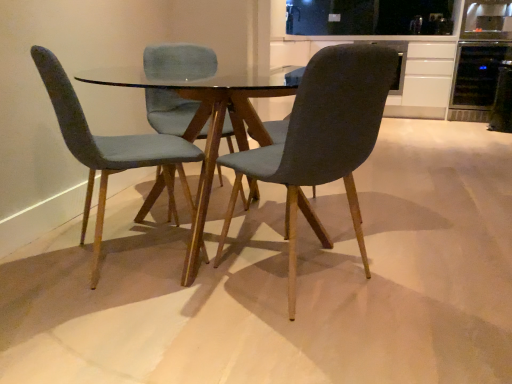
Question: Considering the positions of dark gray fabric chair at center, acting as the 1th chair starting from the right, and black glass wine cooler at upper right, the 1th appliance from the back, in the image, is dark gray fabric chair at center, acting as the 1th chair starting from the right, wider or thinner than black glass wine cooler at upper right, the 1th appliance from the back,?

Choices:
 (A) thin
 (B) wide

Answer: (A)

Question: From a real-world perspective, is dark gray fabric chair at center, acting as the 1th chair starting from the right, physically located above or below black glass wine cooler at upper right, the 1th appliance from the back?

Choices:
 (A) below
 (B) above

Answer: (B)

Question: Which object is the closest to the transparent glass table at center?

Choices:
 (A) velvet teal chair at left, the 1th chair in the left-to-right sequence
 (B) black glass wine cooler at upper right, positioned as the 2th appliance in front-to-back order
 (C) dark gray fabric chair at center, which is counted as the second chair, starting from the left
 (D) black glass refrigerator at upper right, which appears as the 2th appliance when viewed from the back
 (E) white matte cabinet at upper right

Answer: (A)

Question: Which is farther from the black glass wine cooler at upper right, the 1th appliance from the back?

Choices:
 (A) transparent glass table at center
 (B) white matte cabinet at upper right
 (C) velvet teal chair at left, the 1th chair in the left-to-right sequence
 (D) black glass refrigerator at upper right, marked as the first appliance in a front-to-back arrangement
 (E) dark gray fabric chair at center, acting as the 1th chair starting from the right

Answer: (C)